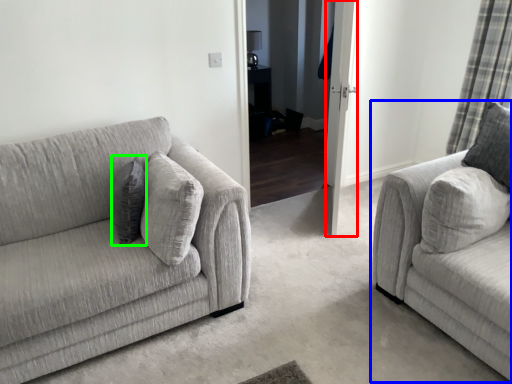
Question: Which object is the closest to the glass door (highlighted by a red box)? Choose among these: studio couch (highlighted by a blue box) or pillow (highlighted by a green box).

Choices:
 (A) studio couch
 (B) pillow

Answer: (A)